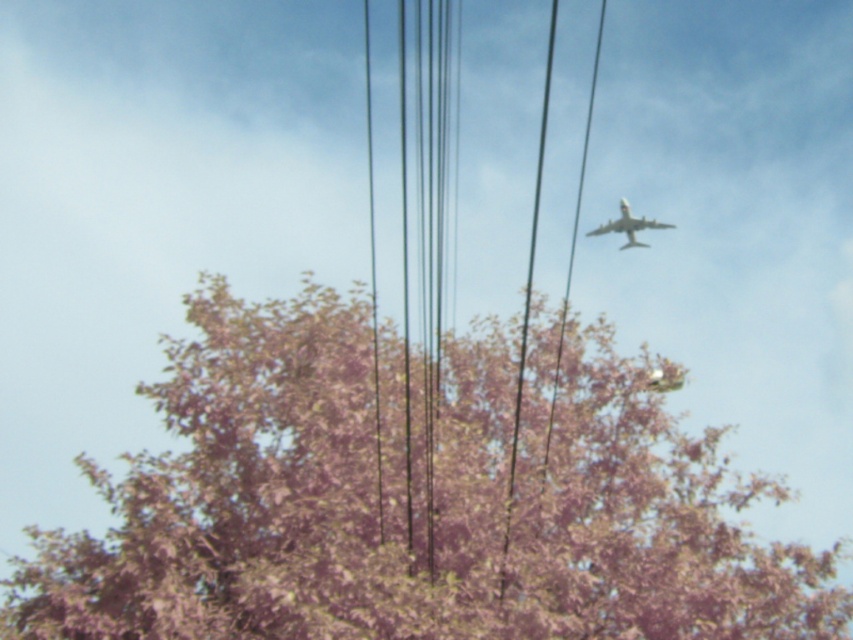
Question: From the image, what is the correct spatial relationship of pink leafy tree at upper center in relation to white matte airplane at upper right?

Choices:
 (A) below
 (B) above

Answer: (A)

Question: Among these points, which one is farthest from the camera?

Choices:
 (A) (531, 516)
 (B) (624, 221)

Answer: (B)

Question: Among these points, which one is nearest to the camera?

Choices:
 (A) (563, 404)
 (B) (613, 225)

Answer: (A)

Question: Is pink leafy tree at upper center wider than white matte airplane at upper right?

Choices:
 (A) yes
 (B) no

Answer: (A)

Question: Is pink leafy tree at upper center positioned before white matte airplane at upper right?

Choices:
 (A) no
 (B) yes

Answer: (B)

Question: Which object appears closest to the camera in this image?

Choices:
 (A) pink leafy tree at upper center
 (B) white matte airplane at upper right

Answer: (A)